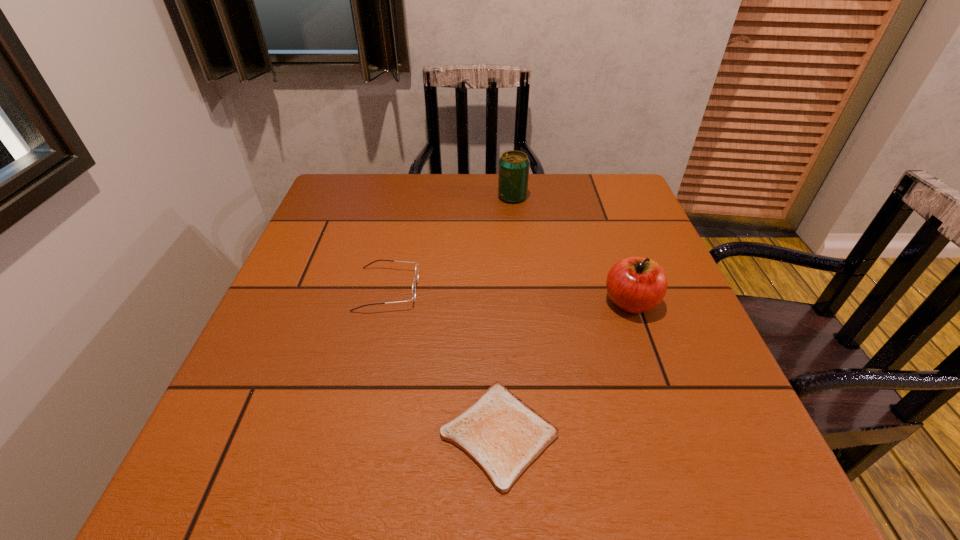
You are a GUI agent. You are given a task and a screenshot of the screen. Output one action in this format:
    pyautogui.click(x=<x>, y=<y>)
    Task: Click on the unoccupied position between the farthest object and the apple
    
    Given the screenshot: What is the action you would take?
    pyautogui.click(x=571, y=249)

Where is `vacant point located between the leftmost object and the farthest object`? vacant point located between the leftmost object and the farthest object is located at coordinates (450, 243).

Identify the location of free spot between the beer can and the third tallest object. This screenshot has height=540, width=960. (450, 243).

Find the location of `vacant space that's between the leftmost object and the beer can`. vacant space that's between the leftmost object and the beer can is located at coordinates (450, 243).

You are a GUI agent. You are given a task and a screenshot of the screen. Output one action in this format:
    pyautogui.click(x=<x>, y=<y>)
    Task: Click on the empty space between the apple and the leftmost object
    
    Given the screenshot: What is the action you would take?
    pyautogui.click(x=509, y=296)

Identify the location of empty location between the farthest object and the rightmost object. point(571,249).

Locate an element on the screen. Image resolution: width=960 pixels, height=540 pixels. unoccupied position between the toast and the rightmost object is located at coordinates (564, 368).

Image resolution: width=960 pixels, height=540 pixels. In order to click on free space that is in between the nearest object and the leftmost object in this screenshot , I will do `click(444, 362)`.

Image resolution: width=960 pixels, height=540 pixels. In order to click on vacant area that lies between the apple and the nearest object in this screenshot , I will do `click(564, 368)`.

I want to click on object that ranks as the third closest to the rightmost object, so click(x=416, y=268).